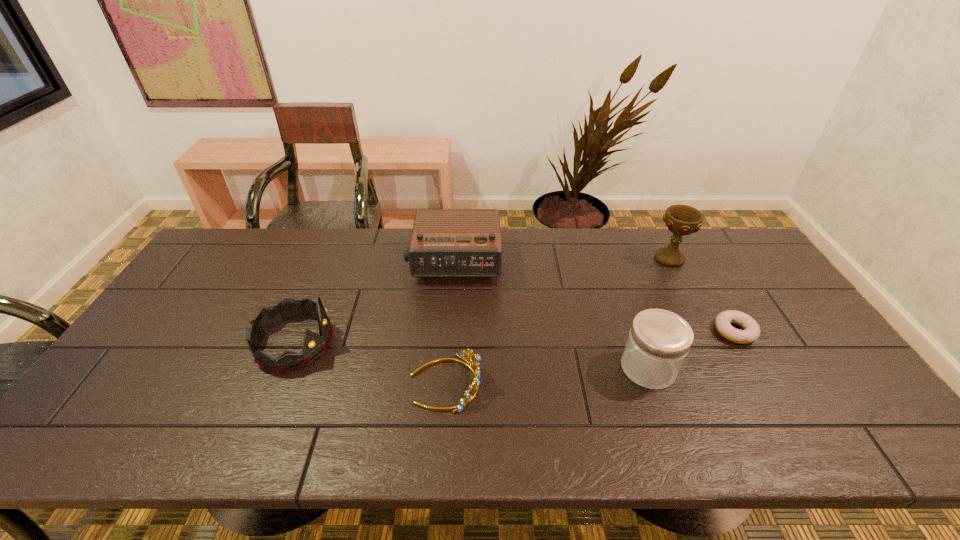
Where is `free space located 0.370m at the front of the leftmost object with jewels`? free space located 0.370m at the front of the leftmost object with jewels is located at coordinates (470, 343).

Locate an element on the screen. The height and width of the screenshot is (540, 960). vacant area situated 0.250m on the right of the third object from right to left is located at coordinates (773, 368).

In order to click on free space located on the front-facing side of the fifth tallest object in this screenshot , I will do `click(529, 383)`.

At what (x,y) coordinates should I click in order to perform the action: click on vacant space situated on the front of the doughnut. Please return your answer as a coordinate pair (x, y). This screenshot has height=540, width=960. Looking at the image, I should click on (805, 454).

Where is `chalice located at the far edge`? The width and height of the screenshot is (960, 540). chalice located at the far edge is located at coordinates click(681, 220).

Find the location of `radio receiver that is at the far edge`. radio receiver that is at the far edge is located at coordinates [444, 242].

The height and width of the screenshot is (540, 960). Find the location of `object that is at the right edge`. object that is at the right edge is located at coordinates (751, 332).

Image resolution: width=960 pixels, height=540 pixels. Identify the location of vacant space at the far edge of the desktop. (570, 239).

This screenshot has width=960, height=540. I want to click on blank area at the left edge, so click(x=229, y=285).

In the image, there is a desktop. Where is `blank space at the far left corner`? blank space at the far left corner is located at coordinates (228, 269).